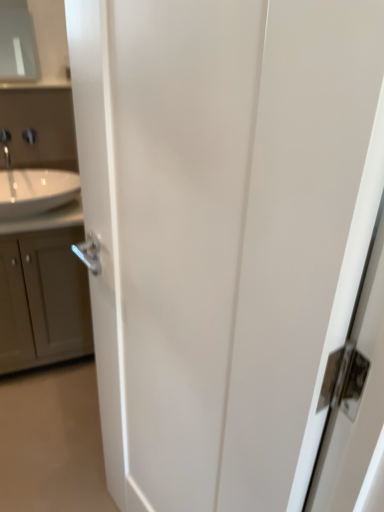
Question: In terms of width, does matte gray cabinet at left look wider or thinner when compared to satin nickel faucet at upper left?

Choices:
 (A) wide
 (B) thin

Answer: (A)

Question: Considering the positions of matte gray cabinet at left and satin nickel faucet at upper left in the image, is matte gray cabinet at left bigger or smaller than satin nickel faucet at upper left?

Choices:
 (A) small
 (B) big

Answer: (B)

Question: Based on their relative distances, which object is farther from the white glossy sink at left?

Choices:
 (A) silver metallic tap at upper left
 (B) matte gray medicine cabinet at upper left
 (C) matte gray cabinet at left
 (D) satin nickel faucet at upper left

Answer: (B)

Question: Based on their relative distances, which object is farther from the silver metallic tap at upper left?

Choices:
 (A) matte gray medicine cabinet at upper left
 (B) white glossy sink at left
 (C) satin nickel faucet at upper left
 (D) matte gray cabinet at left

Answer: (A)